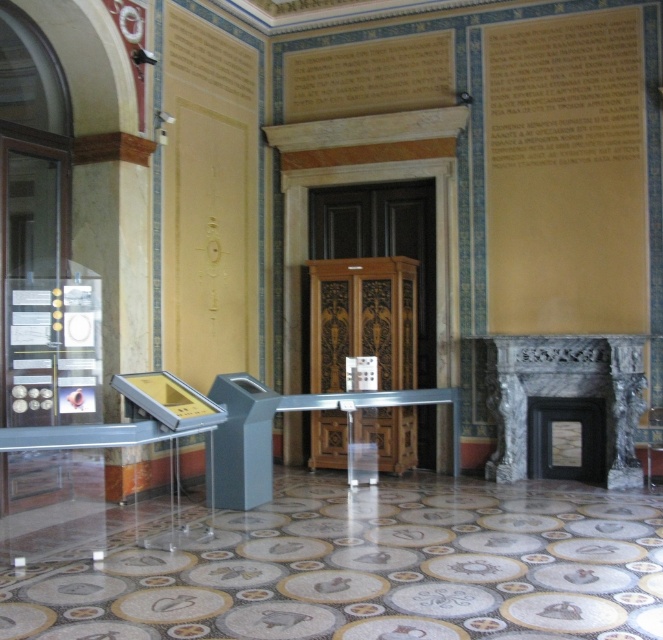
Based on the photo, does wooden carved elevator at center have a larger size compared to marble fireplace at right?

Actually, wooden carved elevator at center might be smaller than marble fireplace at right.

Measure the distance between point (363, 326) and camera.

They are 8.57 meters apart.

I want to click on wooden carved elevator at center, so click(363, 320).